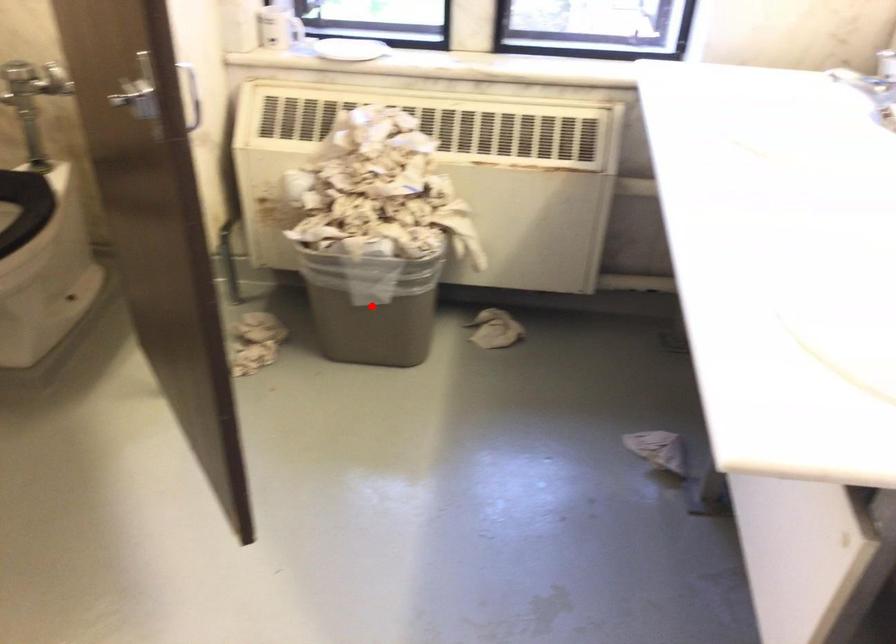
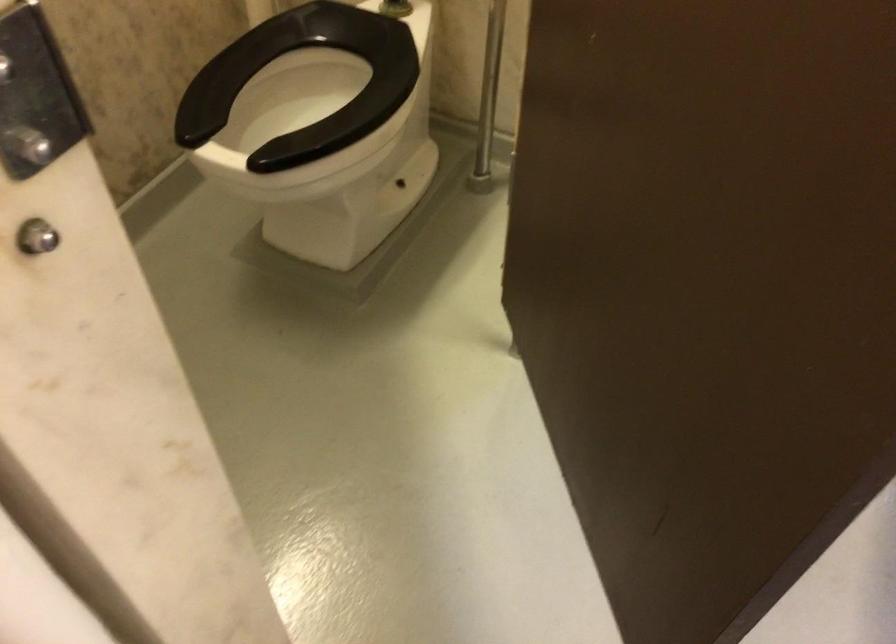
Question: I am providing you with two images of the same scene from different viewpoints. A red point is marked on the first image. At the location where the point appears in image 1, is it still visible in image 2?

Choices:
 (A) Yes
 (B) No

Answer: (B)